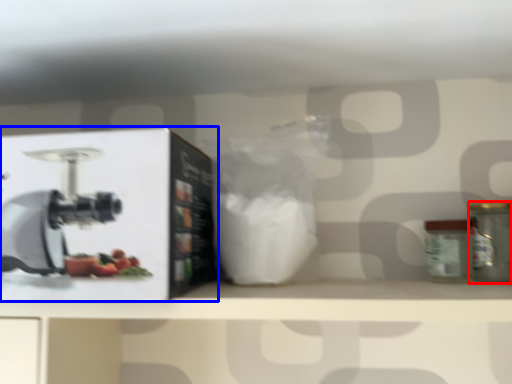
Question: Which object appears farthest to the camera in this image, kitchen appliance (highlighted by a red box) or wide (highlighted by a blue box)?

Choices:
 (A) kitchen appliance
 (B) wide

Answer: (A)